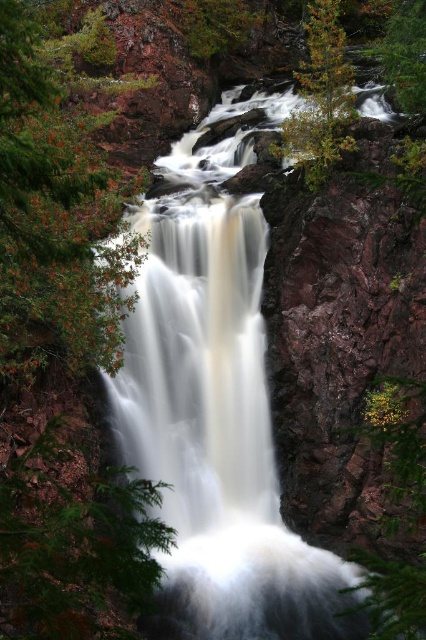
Does brown rough rock at center appear on the left side of green matte tree at upper right?

Yes, brown rough rock at center is to the left of green matte tree at upper right.

Which of these two, brown rough rock at center or green matte tree at upper right, stands taller?

brown rough rock at center

Is point (209, 269) more distant than point (334, 77)?

That is True.

Image resolution: width=426 pixels, height=640 pixels. Find the location of `brown rough rock at center`. brown rough rock at center is located at coordinates (216, 410).

Is point (204, 324) closer to camera compared to point (32, 240)?

No, (204, 324) is further to viewer.

Can you confirm if brown rough rock at center is positioned to the right of green matte tree at left?

Yes, brown rough rock at center is to the right of green matte tree at left.

The height and width of the screenshot is (640, 426). What do you see at coordinates (216, 410) in the screenshot?
I see `brown rough rock at center` at bounding box center [216, 410].

Image resolution: width=426 pixels, height=640 pixels. I want to click on brown rough rock at center, so click(216, 410).

Which is below, green matte tree at left or green matte tree at upper right?

green matte tree at left is lower down.

Who is positioned more to the right, green matte tree at left or green matte tree at upper right?

Positioned to the right is green matte tree at upper right.

I want to click on green matte tree at left, so click(55, 216).